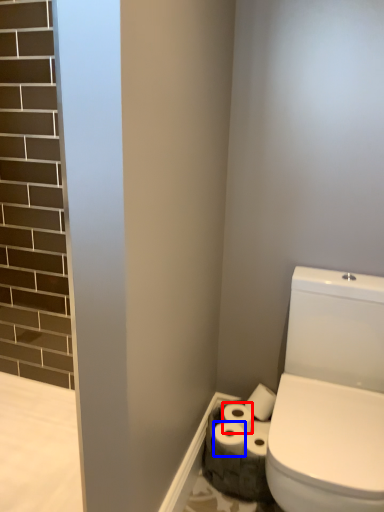
Question: Which object is further to the camera taking this photo, toilet paper (highlighted by a red box) or toilet paper (highlighted by a blue box)?

Choices:
 (A) toilet paper
 (B) toilet paper

Answer: (A)